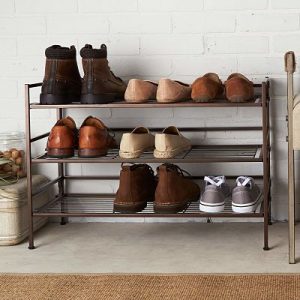
This screenshot has height=300, width=300. In order to click on shoe rack leg in this screenshot , I will do `click(63, 219)`, `click(30, 241)`, `click(270, 216)`, `click(266, 229)`.